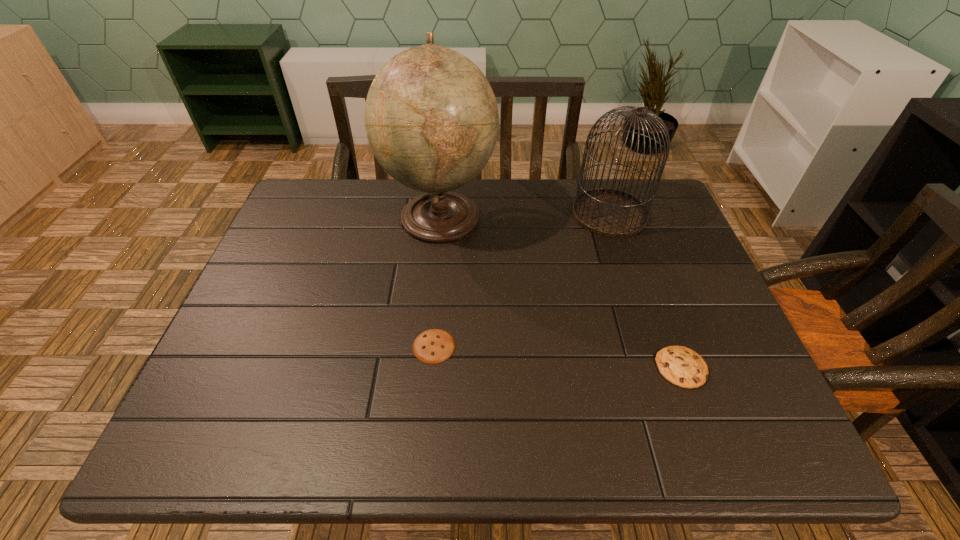
Find the location of a particular element. This screenshot has width=960, height=540. blank region between the right cookie and the shortest object is located at coordinates tap(558, 357).

This screenshot has height=540, width=960. What are the coordinates of `the closest object to the tallest object` in the screenshot? It's located at (611, 213).

This screenshot has height=540, width=960. What are the coordinates of `object identified as the closest to the second shortest object` in the screenshot? It's located at (611, 213).

This screenshot has height=540, width=960. What are the coordinates of `vacant space that satisfies the following two spatial constraints: 1. on the front-facing side of the third tallest object; 2. on the left side of the globe` in the screenshot? It's located at (426, 368).

The width and height of the screenshot is (960, 540). I want to click on free space that satisfies the following two spatial constraints: 1. on the back side of the shorter cookie; 2. on the left side of the birdcage, so click(x=445, y=214).

I want to click on blank area in the image that satisfies the following two spatial constraints: 1. on the front-facing side of the tallest object; 2. on the back side of the taller cookie, so click(x=426, y=368).

Find the location of a particular element. The height and width of the screenshot is (540, 960). free location that satisfies the following two spatial constraints: 1. on the front-facing side of the right cookie; 2. on the left side of the tallest object is located at coordinates (426, 368).

Locate an element on the screen. vacant point that satisfies the following two spatial constraints: 1. on the front-facing side of the globe; 2. on the back side of the right cookie is located at coordinates (426, 368).

The image size is (960, 540). What are the coordinates of `vacant point that satisfies the following two spatial constraints: 1. on the front-facing side of the second shortest object; 2. on the right side of the tallest object` in the screenshot? It's located at (426, 368).

This screenshot has height=540, width=960. I want to click on vacant space that satisfies the following two spatial constraints: 1. on the front-facing side of the tallest object; 2. on the back side of the second shortest object, so click(426, 368).